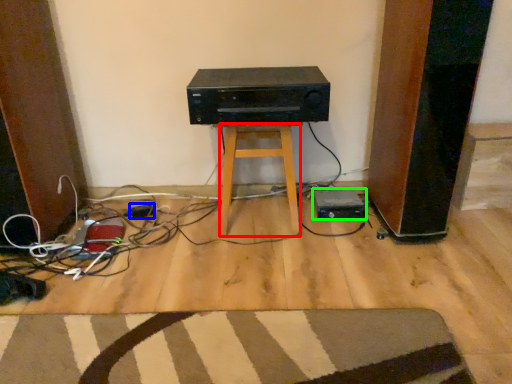
Question: Which object is positioned farthest from stool (highlighted by a red box)? Select from plug (highlighted by a blue box) and appliance (highlighted by a green box).

Choices:
 (A) plug
 (B) appliance

Answer: (A)